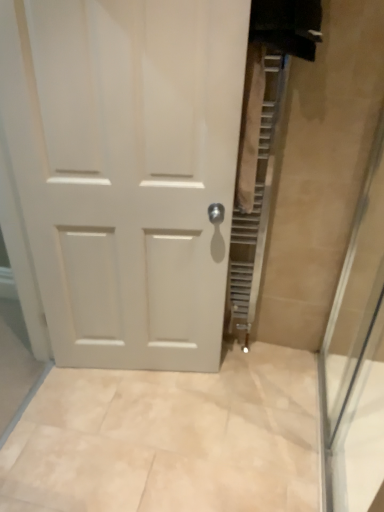
Image resolution: width=384 pixels, height=512 pixels. I want to click on free spot below white matte door at center (from a real-world perspective), so click(139, 373).